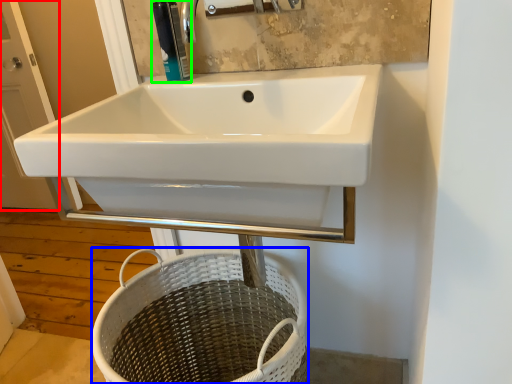
Question: Based on their relative distances, which object is nearer to screen door (highlighted by a red box)? Choose from basket (highlighted by a blue box) and soap dispenser (highlighted by a green box).

Choices:
 (A) basket
 (B) soap dispenser

Answer: (A)